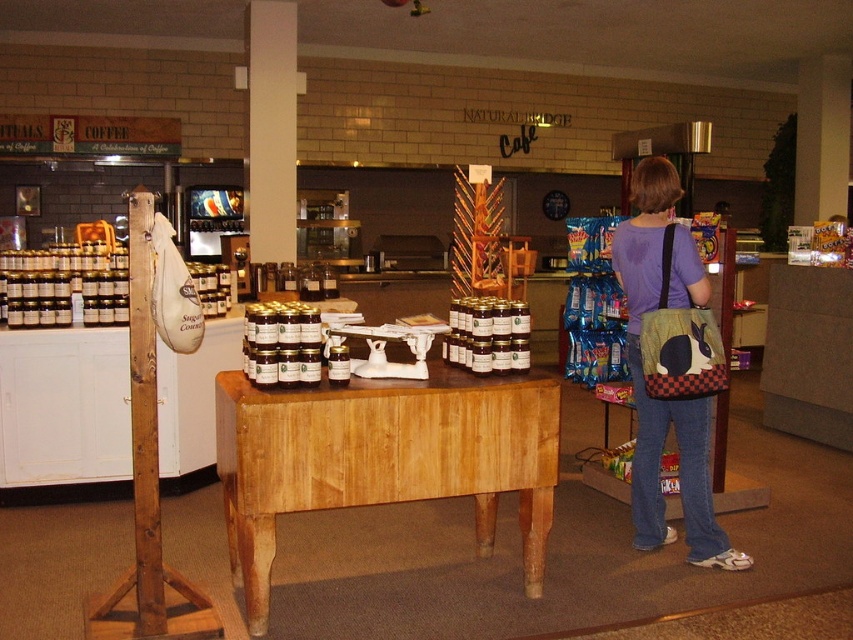
You are standing in the Natural Bridge Cafe and want to place a small decoration between the two points, point (x=456, y=492) and point (x=646, y=515). Which point should the decoration be closer to in order to be nearer to the viewer?

The decoration should be closer to point (x=456, y=492) because it is nearer to the viewer compared to point (x=646, y=515).

You are a customer at Natural Bridge Cafe and want to place your coffee cup on the surface that can accommodate it. Which object, the light brown wood table at center or the matte purple shirt at center, is more suitable for placing your coffee cup?

The light brown wood table at center is more suitable for placing your coffee cup because it is a stable surface, whereas the matte purple shirt at center is likely a clothing item and not meant for holding items.

You are standing in the Natural Bridge Cafe and want to place a new jar of preserves on the light brown wood table at center. The table has a coordinate system where the bottom left corner is the origin point. The point at coordinate (383, 460) is located on the table. Where exactly on the table would this coordinate place the jar?

The coordinate point (383, 460) on the light brown wood table at center places the jar near the upper right side of the table since the coordinate system starts at the bottom left corner.